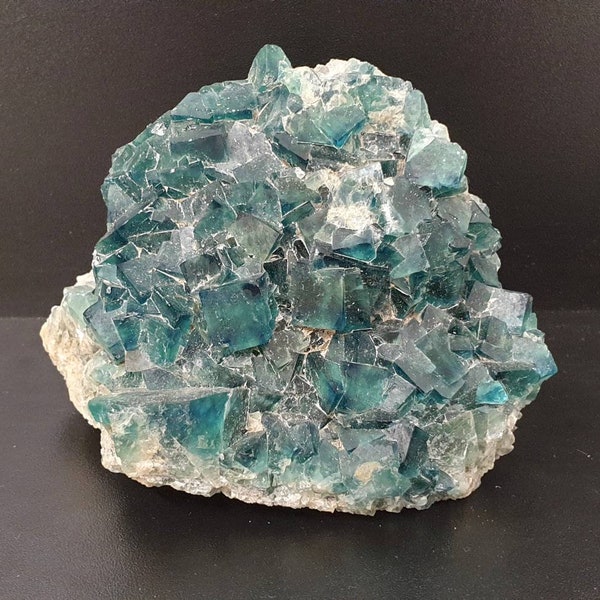
I want to click on black table, so click(526, 527).